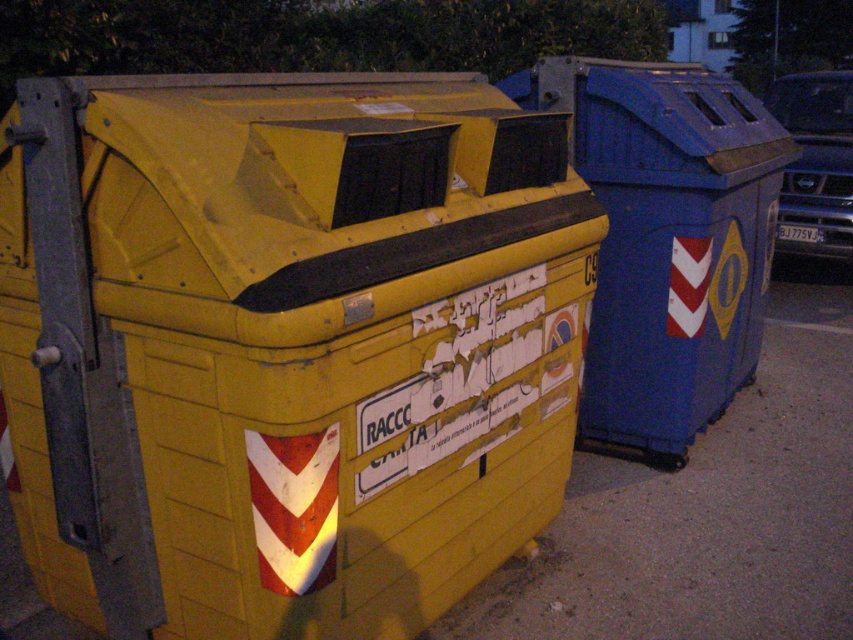
Question: Is yellow matte plastic recycling bin at left in front of blue plastic recycling bin at right?

Choices:
 (A) yes
 (B) no

Answer: (A)

Question: Is yellow matte plastic recycling bin at left to the right of blue plastic recycling bin at right from the viewer's perspective?

Choices:
 (A) no
 (B) yes

Answer: (A)

Question: Does yellow matte plastic recycling bin at left appear under blue plastic recycling bin at right?

Choices:
 (A) yes
 (B) no

Answer: (A)

Question: Which object is farther from the camera taking this photo?

Choices:
 (A) yellow matte plastic recycling bin at left
 (B) blue plastic recycling bin at right

Answer: (B)

Question: Which point appears farthest from the camera in this image?

Choices:
 (A) (564, 72)
 (B) (41, 301)

Answer: (A)